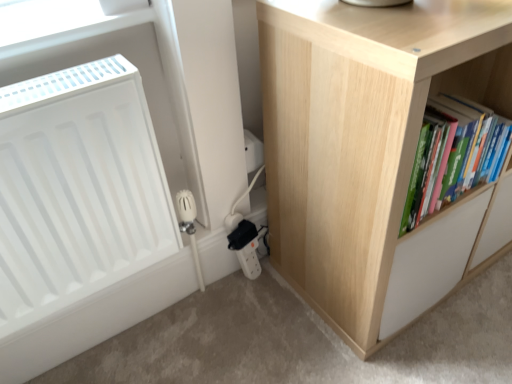
Locate an element on the screen. This screenshot has width=512, height=384. white matte radiator at left is located at coordinates (77, 188).

Measure the distance from green matte book at right to natural wood cupboard at right.

They are 6.00 inches apart.

Based on the photo, does green matte book at right have a greater height compared to natural wood cupboard at right?

Incorrect, the height of green matte book at right is not larger of that of natural wood cupboard at right.

How many degrees apart are the facing directions of green matte book at right and natural wood cupboard at right?

The angular difference between green matte book at right and natural wood cupboard at right is 0.000899 degrees.

From the image's perspective, is green matte book at right under natural wood cupboard at right?

Yes.

Is white matte radiator at left inside the boundaries of green matte book at right, or outside?

white matte radiator at left is not enclosed by green matte book at right.

From a real-world perspective, who is located higher, white matte radiator at left or green matte book at right?

green matte book at right, from a real-world perspective.

Does white matte radiator at left have a greater width compared to green matte book at right?

No, white matte radiator at left is not wider than green matte book at right.

Between white matte radiator at left and green matte book at right, which one has less height?

green matte book at right.

Which is in front, natural wood cupboard at right or white matte radiator at left?

white matte radiator at left.

Is white matte radiator at left at the back of natural wood cupboard at right?

No, natural wood cupboard at right is not facing the opposite direction of white matte radiator at left.

Considering the sizes of objects natural wood cupboard at right and white matte radiator at left in the image provided, who is smaller, natural wood cupboard at right or white matte radiator at left?

white matte radiator at left is smaller.

There is a natural wood cupboard at right. In order to click on radiator above it (from a real-world perspective) in this screenshot , I will do `click(77, 188)`.

Considering the sizes of objects green matte book at right and white matte radiator at left in the image provided, who is wider, green matte book at right or white matte radiator at left?

Wider between the two is green matte book at right.

Can you tell me how much green matte book at right and white matte radiator at left differ in facing direction?

0.249 degrees.

Is green matte book at right surrounding white matte radiator at left?

No, green matte book at right does not contain white matte radiator at left.

From the image's perspective, which object appears higher, natural wood cupboard at right or green matte book at right?

natural wood cupboard at right, from the image's perspective.

Locate an element on the screen. The width and height of the screenshot is (512, 384). book above the natural wood cupboard at right (from a real-world perspective) is located at coordinates (453, 155).

Between point (469, 262) and point (420, 133), which one is positioned behind?

Positioned behind is point (469, 262).

Based on the photo, is natural wood cupboard at right facing away from green matte book at right?

Yes, green matte book at right is at the back of natural wood cupboard at right.

Is white matte radiator at left inside or outside of natural wood cupboard at right?

white matte radiator at left lies outside natural wood cupboard at right.

Between white matte radiator at left and natural wood cupboard at right, which one has less height?

Standing shorter between the two is white matte radiator at left.

Based on their positions, is white matte radiator at left located to the left or right of natural wood cupboard at right?

white matte radiator at left is positioned on natural wood cupboard at right's left side.

Find the location of a particular element. book on the left of natural wood cupboard at right is located at coordinates (453, 155).

Find the location of a particular element. book to the right of white matte radiator at left is located at coordinates (453, 155).

Based on the photo, estimate the real-world distances between objects in this image. Which object is closer to green matte book at right, natural wood cupboard at right or white matte radiator at left?

The object closer to green matte book at right is natural wood cupboard at right.

Considering their positions, is white matte radiator at left positioned closer to green matte book at right than natural wood cupboard at right?

Based on the image, natural wood cupboard at right appears to be nearer to green matte book at right.

Looking at the image, which one is located closer to natural wood cupboard at right, white matte radiator at left or green matte book at right?

green matte book at right lies closer to natural wood cupboard at right than the other object.

Based on their spatial positions, is green matte book at right or white matte radiator at left further from natural wood cupboard at right?

white matte radiator at left lies further to natural wood cupboard at right than the other object.

Estimate the real-world distances between objects in this image. Which object is closer to white matte radiator at left, natural wood cupboard at right or green matte book at right?

natural wood cupboard at right is positioned closer to the anchor white matte radiator at left.

Estimate the real-world distances between objects in this image. Which object is further from white matte radiator at left, green matte book at right or natural wood cupboard at right?

The object further to white matte radiator at left is green matte book at right.

Where is `book situated between white matte radiator at left and natural wood cupboard at right from left to right`? The image size is (512, 384). book situated between white matte radiator at left and natural wood cupboard at right from left to right is located at coordinates (453, 155).